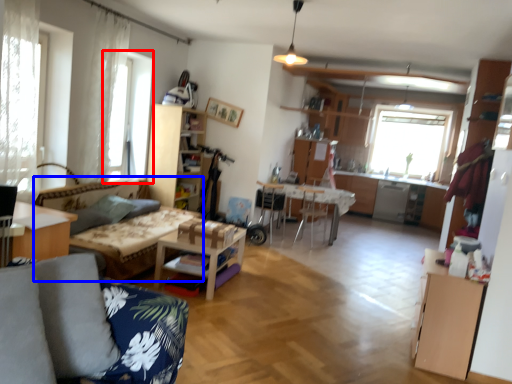
Question: Which point is closer to the camera, window (highlighted by a red box) or couch (highlighted by a blue box)?

Choices:
 (A) window
 (B) couch

Answer: (B)